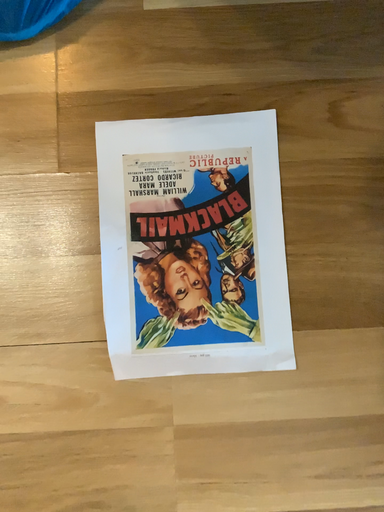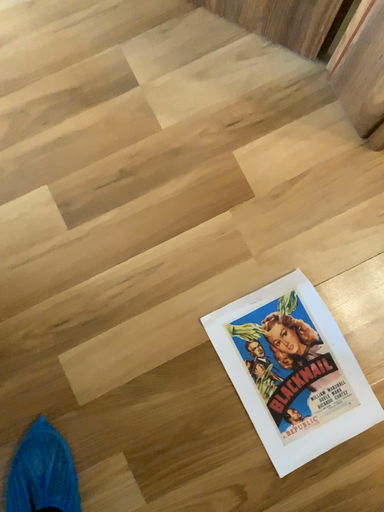
Question: Which way did the camera rotate in the video?

Choices:
 (A) rotated downward
 (B) rotated upward

Answer: (B)